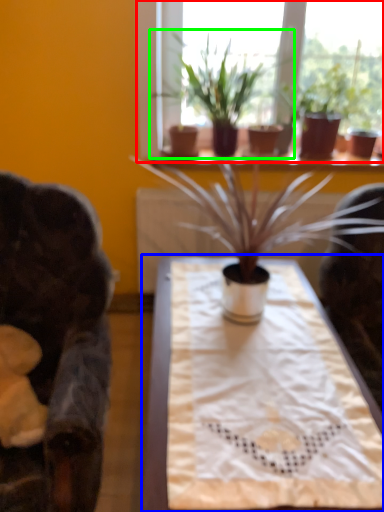
Question: Which object is positioned closest to window (highlighted by a red box)? Select from table (highlighted by a blue box) and houseplant (highlighted by a green box).

Choices:
 (A) table
 (B) houseplant

Answer: (B)